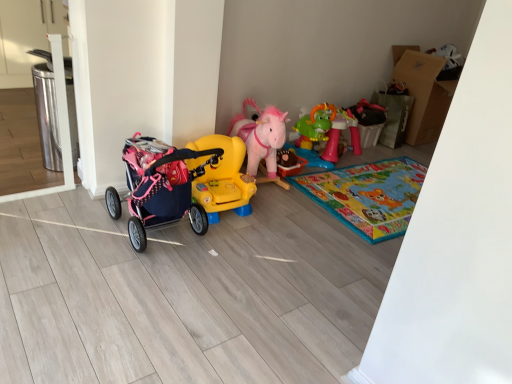
Where is `vacant space situated on the left part of pink fabric stroller at left, which is counted as the 4th toy, starting from the right`? vacant space situated on the left part of pink fabric stroller at left, which is counted as the 4th toy, starting from the right is located at coordinates (68, 233).